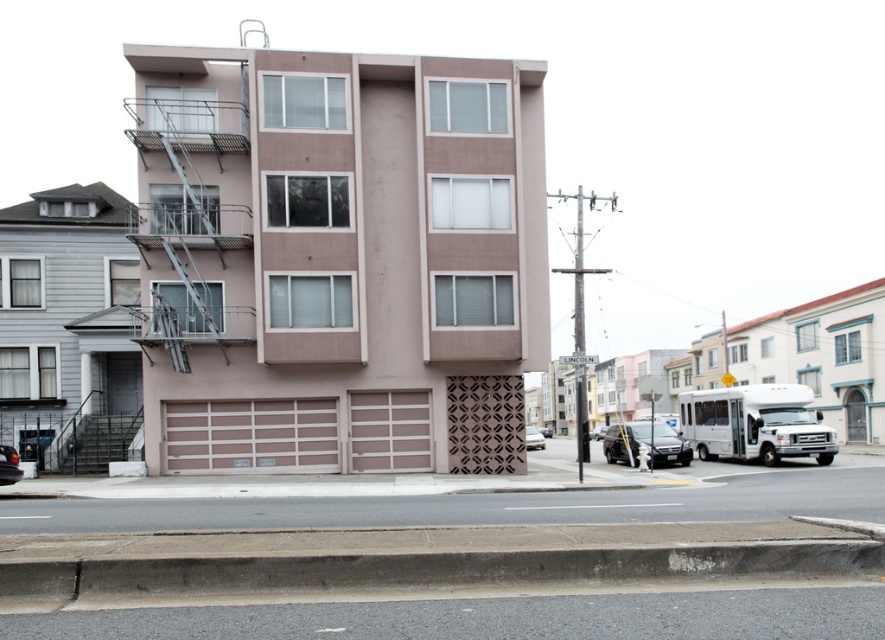
Based on the photo, you are standing on the sidewalk in front of the residential building. You see two points marked on the ground. One is at point (147, 189) and the other at point (2, 449). Which point is closer to you?

Point (147, 189) is further to the camera than point (2, 449). Therefore, the point closer to you is point (2, 449).

You are a pedestrian standing on the sidewalk in front of the building. You notice the metallic silver fire escape at left and the matte black sedan at lower right. Which object is nearer to you?

The metallic silver fire escape at left is closer to the viewer than the matte black sedan at lower right, so the fire escape is nearer to you.